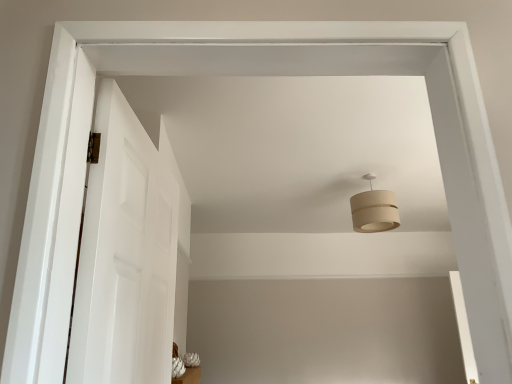
Image resolution: width=512 pixels, height=384 pixels. What are the coordinates of `beige fabric lampshade at upper center` in the screenshot? It's located at point(374,210).

You are a GUI agent. You are given a task and a screenshot of the screen. Output one action in this format:
    pyautogui.click(x=<x>, y=<y>)
    Task: Click on the white smooth door at left
    The image size is (512, 384).
    Given the screenshot: What is the action you would take?
    pyautogui.click(x=127, y=252)

Where is `beige fabric lampshade at upper center`? beige fabric lampshade at upper center is located at coordinates (374, 210).

Is white smooth door at left inside the boundaries of beige fabric lampshade at upper center, or outside?

white smooth door at left is outside beige fabric lampshade at upper center.

Between white smooth door at left and beige fabric lampshade at upper center, which one has less height?

With less height is beige fabric lampshade at upper center.

Which object is thinner, white smooth door at left or beige fabric lampshade at upper center?

With smaller width is white smooth door at left.

Is white smooth door at left turned away from beige fabric lampshade at upper center?

No, white smooth door at left is not facing the opposite direction of beige fabric lampshade at upper center.

Is white smooth door at left taller or shorter than white glossy vase at lower center?

In the image, white smooth door at left appears to be taller than white glossy vase at lower center.

Does white smooth door at left turn towards white glossy vase at lower center?

No, white smooth door at left is not turned towards white glossy vase at lower center.

Does white smooth door at left have a smaller size compared to white glossy vase at lower center?

No, white smooth door at left is not smaller than white glossy vase at lower center.

Measure the distance between white smooth door at left and white glossy vase at lower center.

white smooth door at left is 2.51 meters from white glossy vase at lower center.

Is white glossy vase at lower center directly adjacent to beige fabric lampshade at upper center?

No, white glossy vase at lower center is not making contact with beige fabric lampshade at upper center.

From a real-world perspective, is white glossy vase at lower center physically above beige fabric lampshade at upper center?

No, from a real-world perspective, white glossy vase at lower center is not over beige fabric lampshade at upper center

From the image's perspective, which one is positioned lower, white glossy vase at lower center or beige fabric lampshade at upper center?

white glossy vase at lower center is shown below in the image.

Is beige fabric lampshade at upper center facing towards white smooth door at left?

No, beige fabric lampshade at upper center is not aimed at white smooth door at left.

Where is `fixture that is on the right side of white smooth door at left`? fixture that is on the right side of white smooth door at left is located at coordinates (374, 210).

Based on the photo, from a real-world perspective, between beige fabric lampshade at upper center and white smooth door at left, who is vertically lower?

white smooth door at left is physically lower.

Is beige fabric lampshade at upper center further to camera compared to white smooth door at left?

Yes, beige fabric lampshade at upper center is further from the camera.

Is beige fabric lampshade at upper center facing towards white glossy vase at lower center?

No, beige fabric lampshade at upper center is not oriented towards white glossy vase at lower center.

Would you say beige fabric lampshade at upper center is to the left or to the right of white glossy vase at lower center in the picture?

In the image, beige fabric lampshade at upper center appears on the right side of white glossy vase at lower center.

Is the position of beige fabric lampshade at upper center more distant than that of white glossy vase at lower center?

Yes, beige fabric lampshade at upper center is behind white glossy vase at lower center.

Is white glossy vase at lower center facing towards white smooth door at left?

No, white glossy vase at lower center is not oriented towards white smooth door at left.

What's the angular difference between white glossy vase at lower center and white smooth door at left's facing directions?

There is a 4.43-degree angle between the facing directions of white glossy vase at lower center and white smooth door at left.

Is white smooth door at left completely or partially inside white glossy vase at lower center?

No, white smooth door at left is located outside of white glossy vase at lower center.

In order to click on door above the white glossy vase at lower center (from the image's perspective) in this screenshot , I will do `click(127, 252)`.

Find the location of a particular element. The image size is (512, 384). door in front of the beige fabric lampshade at upper center is located at coordinates (127, 252).

The width and height of the screenshot is (512, 384). I want to click on furniture on the left of white smooth door at left, so click(189, 376).

Estimate the real-world distances between objects in this image. Which object is further from white smooth door at left, white glossy vase at lower center or beige fabric lampshade at upper center?

Among the two, white glossy vase at lower center is located further to white smooth door at left.

Considering their positions, is beige fabric lampshade at upper center positioned closer to white glossy vase at lower center than white smooth door at left?

Based on the image, beige fabric lampshade at upper center appears to be nearer to white glossy vase at lower center.

Considering their positions, is white glossy vase at lower center positioned further to beige fabric lampshade at upper center than white smooth door at left?

The object further to beige fabric lampshade at upper center is white glossy vase at lower center.

From the image, which object appears to be nearer to white glossy vase at lower center, white smooth door at left or beige fabric lampshade at upper center?

beige fabric lampshade at upper center.

Looking at the image, which one is located closer to white smooth door at left, beige fabric lampshade at upper center or white glossy vase at lower center?

beige fabric lampshade at upper center lies closer to white smooth door at left than the other object.

Looking at the image, which one is located closer to beige fabric lampshade at upper center, white smooth door at left or white glossy vase at lower center?

white smooth door at left.

I want to click on furniture between white smooth door at left and beige fabric lampshade at upper center in the front-back direction, so click(x=189, y=376).